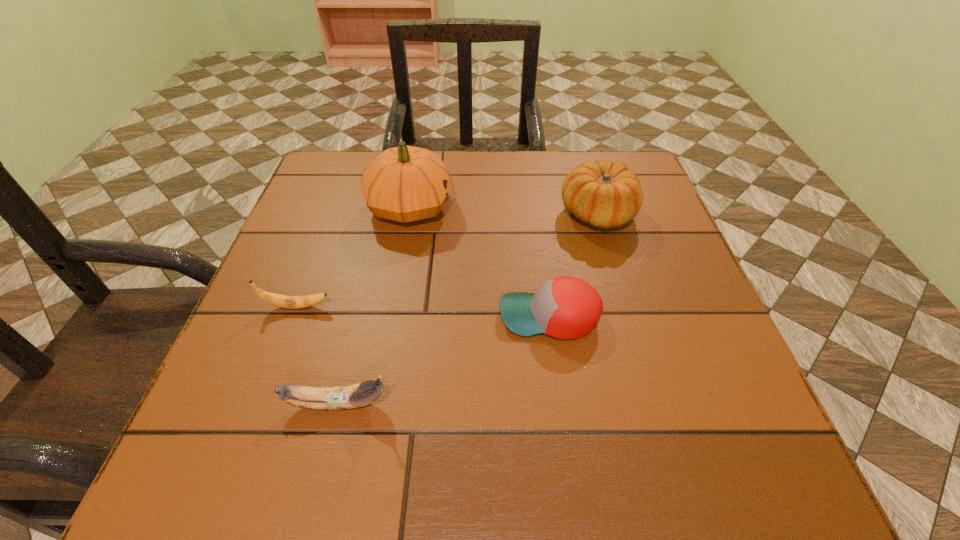
Identify the location of free space located on the peel of the third shortest object. Image resolution: width=960 pixels, height=540 pixels. (520, 403).

Where is `blank area located 0.090m at the brim of the baseball cap`? The image size is (960, 540). blank area located 0.090m at the brim of the baseball cap is located at coordinates (449, 316).

At what (x,y) coordinates should I click in order to perform the action: click on free spot located 0.320m at the brim of the baseball cap. Please return your answer as a coordinate pair (x, y). Image resolution: width=960 pixels, height=540 pixels. Looking at the image, I should click on (323, 316).

Where is `vacant area situated at the brim of the baseball cap`? vacant area situated at the brim of the baseball cap is located at coordinates (433, 316).

Locate an element on the screen. This screenshot has width=960, height=540. free space located on the peel of the farther banana from the top is located at coordinates (536, 307).

This screenshot has width=960, height=540. I want to click on gourd at the left edge, so click(405, 183).

Locate an element on the screen. This screenshot has width=960, height=540. object at the right edge is located at coordinates (605, 195).

The height and width of the screenshot is (540, 960). Identify the location of object that is at the far left corner. (405, 183).

The height and width of the screenshot is (540, 960). Find the location of `object that is at the far right corner`. object that is at the far right corner is located at coordinates point(605,195).

Identify the location of vacant space at the far edge of the desktop. (549, 179).